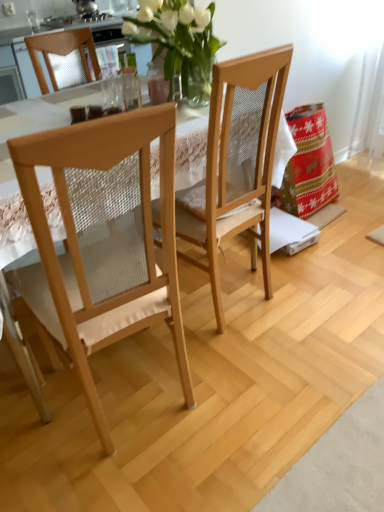
Where is `vacant area situated below light wood/mesh chair at left, which is the 1th chair from left to right (from a real-world perspective)`? Image resolution: width=384 pixels, height=512 pixels. vacant area situated below light wood/mesh chair at left, which is the 1th chair from left to right (from a real-world perspective) is located at coordinates (141, 403).